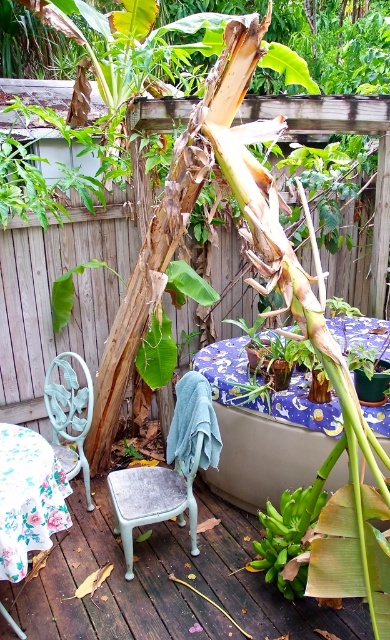
Between wooden fence at upper center and teal fabric stool at lower left, which one is positioned lower?

teal fabric stool at lower left is below.

Between wooden fence at upper center and teal fabric stool at lower left, which one appears on the right side from the viewer's perspective?

teal fabric stool at lower left is more to the right.

The image size is (390, 640). I want to click on wooden fence at upper center, so click(49, 292).

Does wooden deck at center have a lesser height compared to light blue painted metal chair at lower left?

Yes, wooden deck at center is shorter than light blue painted metal chair at lower left.

What do you see at coordinates (166, 582) in the screenshot? The height and width of the screenshot is (640, 390). I see `wooden deck at center` at bounding box center [166, 582].

Is point (157, 564) positioned behind point (69, 355)?

That is False.

Identify the location of wooden deck at center. This screenshot has height=640, width=390. [166, 582].

Is the position of teal fabric stool at lower left more distant than that of light blue painted metal chair at lower left?

No.

Who is more distant from viewer, (182,438) or (81,408)?

The point (81,408) is behind.

At what (x,y) coordinates should I click in order to perform the action: click on teal fabric stool at lower left. Please return your answer as a coordinate pair (x, y). The height and width of the screenshot is (640, 390). Looking at the image, I should click on (170, 468).